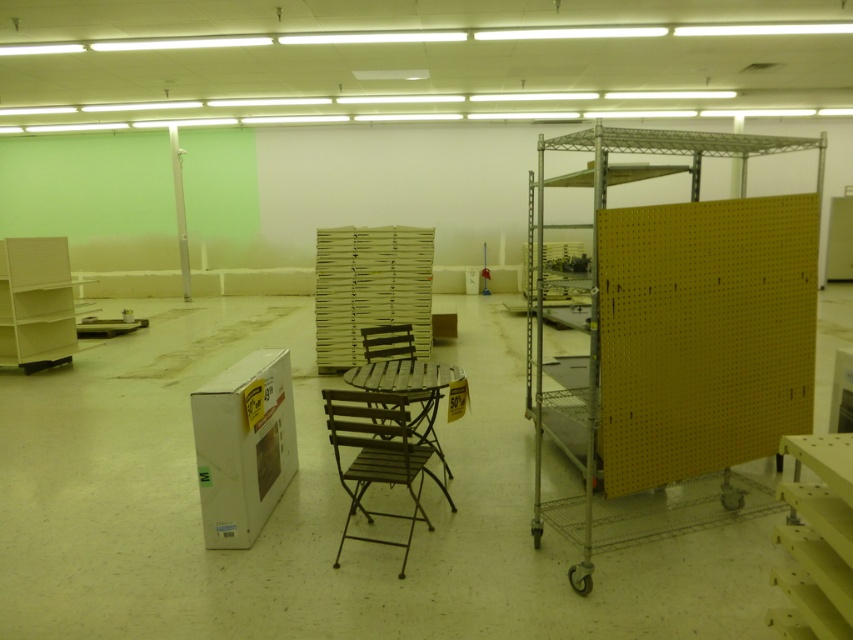
Measure the distance between yellow pegboard at right and brown wood table at center.

They are 88.26 centimeters apart.

Can you confirm if yellow pegboard at right is positioned above brown wood table at center?

Yes.

Who is more forward, (683, 340) or (415, 394)?

Point (683, 340) is in front.

I want to click on yellow pegboard at right, so (x=672, y=340).

Is brown metal chair at center smaller than brown wood table at center?

Incorrect, brown metal chair at center is not smaller in size than brown wood table at center.

Is brown metal chair at center below brown wood table at center?

Yes.

Find the location of a particular element. Image resolution: width=853 pixels, height=640 pixels. brown metal chair at center is located at coordinates (376, 454).

From the picture: Between brown metal chair at center and brown wood chair at center, which one is positioned lower?

brown metal chair at center

Which is in front, point (386, 416) or point (392, 333)?

Positioned in front is point (386, 416).

In order to click on brown metal chair at center in this screenshot , I will do coord(376,454).